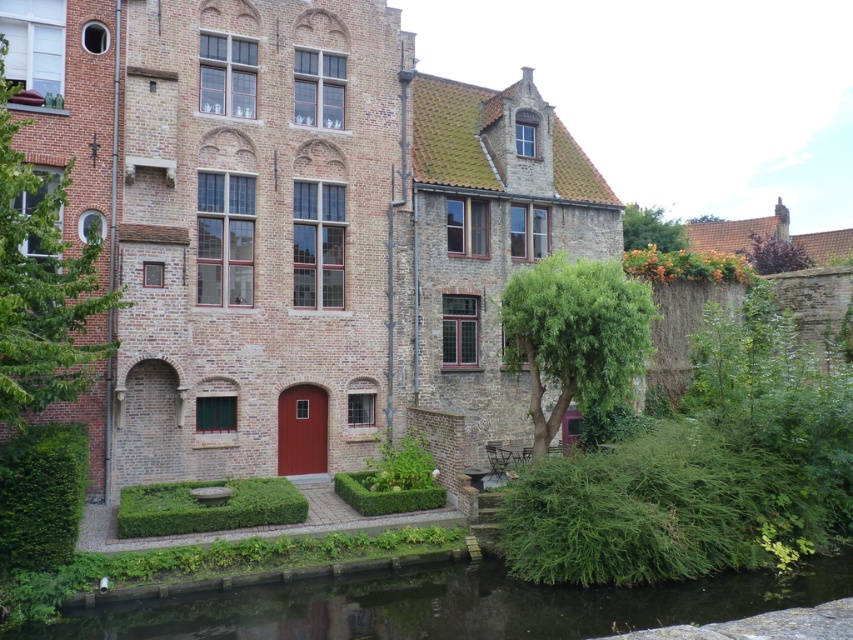
Between green leafy tree at upper right and purple leafy tree at upper right, which one has less height?

Standing shorter between the two is purple leafy tree at upper right.

Who is more distant from viewer, [633,236] or [772,253]?

The point [633,236] is behind.

Image resolution: width=853 pixels, height=640 pixels. In order to click on green leafy tree at upper right in this screenshot , I will do `click(650, 228)`.

Is green leafy tree at upper left above purple leafy tree at upper right?

Actually, green leafy tree at upper left is below purple leafy tree at upper right.

You are a GUI agent. You are given a task and a screenshot of the screen. Output one action in this format:
    pyautogui.click(x=<x>, y=<y>)
    Task: Click on the green leafy tree at upper left
    
    Given the screenshot: What is the action you would take?
    pyautogui.click(x=41, y=284)

You are a GUI agent. You are given a task and a screenshot of the screen. Output one action in this format:
    pyautogui.click(x=<x>, y=<y>)
    Task: Click on the green leafy tree at upper left
    
    Given the screenshot: What is the action you would take?
    pyautogui.click(x=41, y=284)

Who is more distant from viewer, (641, 364) or (643, 236)?

Positioned behind is point (643, 236).

Which is behind, point (527, 339) or point (637, 227)?

The point (637, 227) is behind.

Where is `green leafy tree at center`? green leafy tree at center is located at coordinates (575, 333).